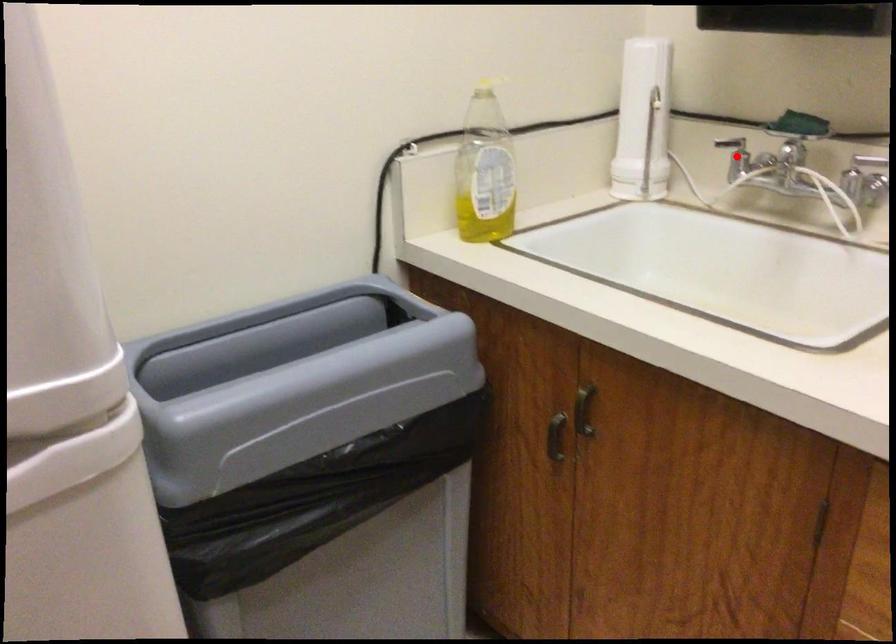
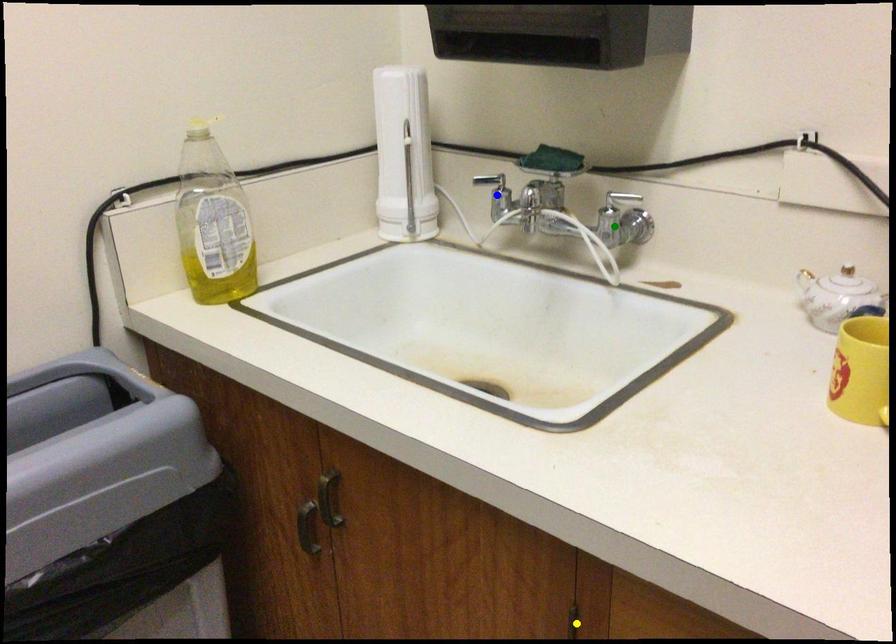
Question: I am providing you with two images of the same scene from different viewpoints. A red point is marked on the first image. You are given multiple points on the second image. In image 2, which mark is for the same physical point as the one in image 1?

Choices:
 (A) yellow point
 (B) green point
 (C) blue point

Answer: (C)